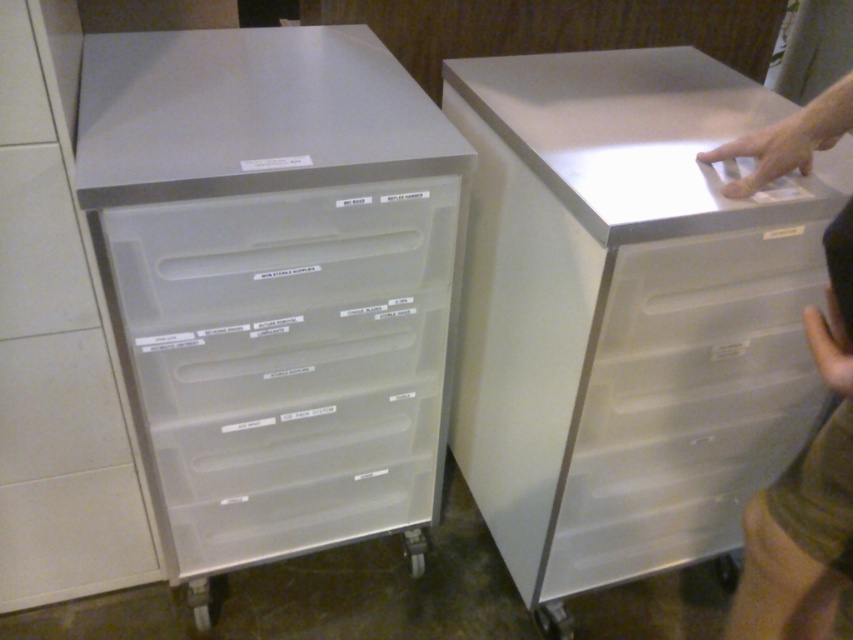
Based on the photo, you are moving office equipment and need to slide a 24 inch wide printer between the clear plastic drawers at left and the skinny jeans at right. Can the printer fit through the space between them?

The distance between the clear plastic drawers at left and the skinny jeans at right is 23.97 inches, which is slightly less than the printer width of 24 inches. Therefore, the printer cannot fit through the space between them.

You are moving office equipment and need to place a new printer. The printer requires a flat surface that is not reflective. Which object among the clear plastic drawers at left should you avoid placing it on?

You should avoid placing the printer on the clear plastic drawers at left because its top surface is smooth and reflective, as mentioned in the scene description.